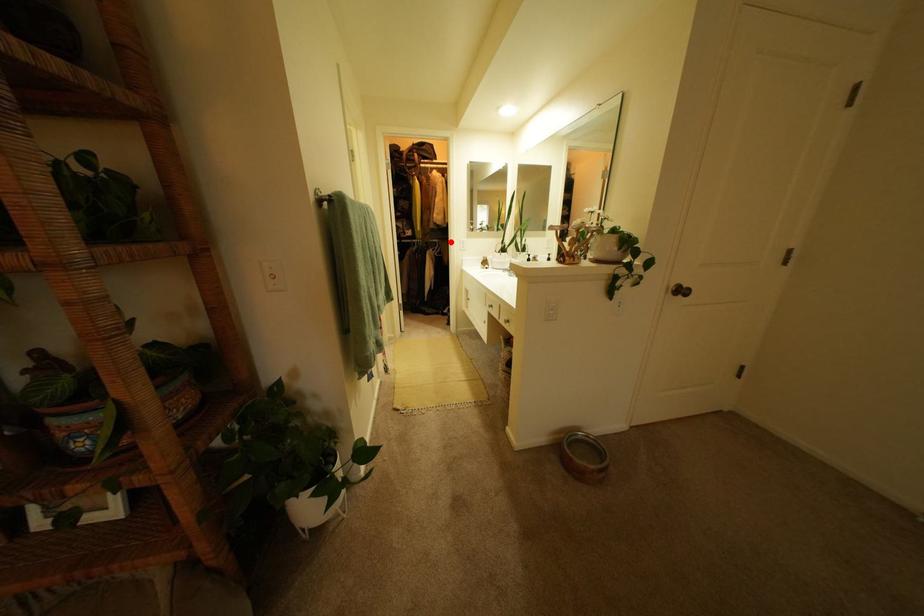
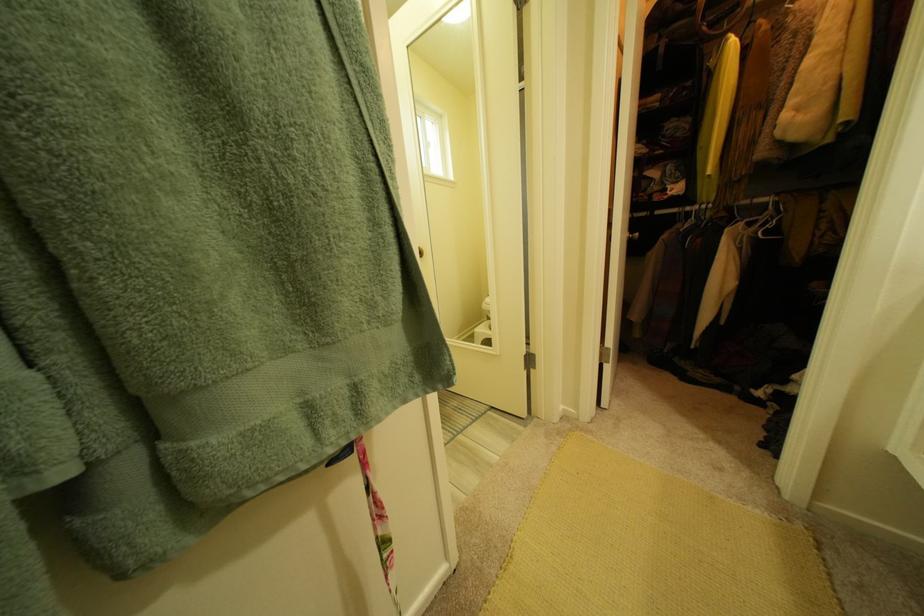
Question: I am providing you with two images of the same scene from different viewpoints. A red point is shown in image1. For the corresponding object point in image2, is it positioned nearer or farther from the camera?

Choices:
 (A) Nearer
 (B) Farther

Answer: (B)